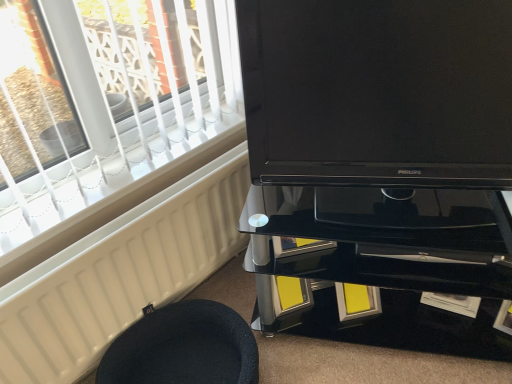
Question: From a real-world perspective, is black fabric stool at lower left physically above white matte radiator at lower left?

Choices:
 (A) yes
 (B) no

Answer: (B)

Question: Considering the relative sizes of black fabric stool at lower left and white matte radiator at lower left in the image provided, is black fabric stool at lower left taller than white matte radiator at lower left?

Choices:
 (A) no
 (B) yes

Answer: (A)

Question: Is black fabric stool at lower left facing towards white matte radiator at lower left?

Choices:
 (A) no
 (B) yes

Answer: (A)

Question: Is the position of black fabric stool at lower left less distant than that of white matte radiator at lower left?

Choices:
 (A) yes
 (B) no

Answer: (B)

Question: Are black fabric stool at lower left and white matte radiator at lower left making contact?

Choices:
 (A) yes
 (B) no

Answer: (B)

Question: Considering the relative positions of black fabric stool at lower left and white matte radiator at lower left in the image provided, is black fabric stool at lower left to the right of white matte radiator at lower left from the viewer's perspective?

Choices:
 (A) no
 (B) yes

Answer: (B)

Question: Is white matte radiator at lower left wider than black glass tv cabinet at center?

Choices:
 (A) yes
 (B) no

Answer: (B)

Question: Is white matte radiator at lower left oriented towards black glass tv cabinet at center?

Choices:
 (A) no
 (B) yes

Answer: (B)

Question: Considering the relative sizes of white matte radiator at lower left and black glass tv cabinet at center in the image provided, is white matte radiator at lower left taller than black glass tv cabinet at center?

Choices:
 (A) no
 (B) yes

Answer: (A)

Question: Can you see white matte radiator at lower left touching black glass tv cabinet at center?

Choices:
 (A) no
 (B) yes

Answer: (A)

Question: Is white matte radiator at lower left bigger than black glass tv cabinet at center?

Choices:
 (A) yes
 (B) no

Answer: (B)

Question: From the image's perspective, is white matte radiator at lower left below black glass tv cabinet at center?

Choices:
 (A) yes
 (B) no

Answer: (A)

Question: Does black fabric stool at lower left have a lesser width compared to black glass tv cabinet at center?

Choices:
 (A) no
 (B) yes

Answer: (A)